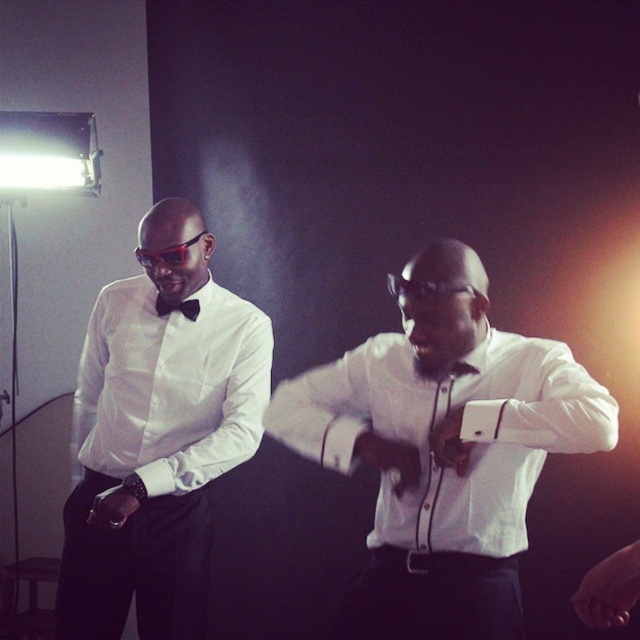
You are a photographer setting up a shoot. You notice the white satin bow tie at left and the black plastic goggles at left in the frame. Given that the minimum focus distance for your lens is 35 centimeters, will you be able to focus on both objects without adjusting the focus?

The white satin bow tie at left is 36.81 centimeters away from the black plastic goggles at left. Since the distance between them is 36.81 cm, which is greater than the minimum focus distance of 35 cm, the lens can focus on both objects without adjustment.

Looking at this image, you are a photographer adjusting the lighting for a formal event. You notice the white satin bow tie at left and the black plastic goggles at left in the frame. Which object should you focus on first to ensure proper exposure, considering their positions?

The white satin bow tie at left is closer to the viewer than the black plastic goggles at left, so you should focus on the white satin bow tie at left first to ensure proper exposure.